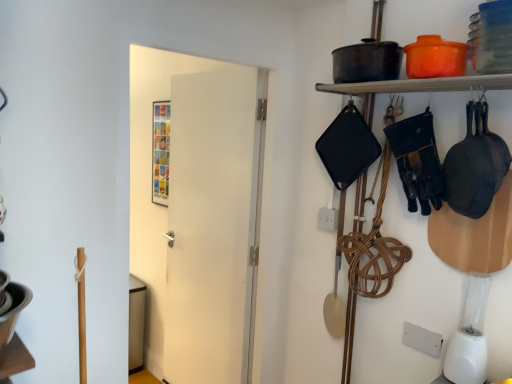
Question: Is matte black pot at upper right at the right side of white matte door at center?

Choices:
 (A) no
 (B) yes

Answer: (B)

Question: Is matte black pot at upper right turned away from white matte door at center?

Choices:
 (A) no
 (B) yes

Answer: (A)

Question: Considering the relative sizes of matte black pot at upper right and white matte door at center in the image provided, is matte black pot at upper right shorter than white matte door at center?

Choices:
 (A) no
 (B) yes

Answer: (B)

Question: Is matte black pot at upper right positioned before white matte door at center?

Choices:
 (A) yes
 (B) no

Answer: (A)

Question: Are matte black pot at upper right and white matte door at center beside each other?

Choices:
 (A) yes
 (B) no

Answer: (B)

Question: Is matte black pot at upper right situated inside white matte door at center or outside?

Choices:
 (A) outside
 (B) inside

Answer: (A)

Question: From the image's perspective, is matte black pot at upper right above or below white matte door at center?

Choices:
 (A) below
 (B) above

Answer: (B)

Question: In terms of width, does matte black pot at upper right look wider or thinner when compared to white matte door at center?

Choices:
 (A) wide
 (B) thin

Answer: (A)

Question: Considering the positions of matte black pot at upper right and white matte door at center in the image, is matte black pot at upper right bigger or smaller than white matte door at center?

Choices:
 (A) big
 (B) small

Answer: (B)

Question: In terms of width, does white matte door at center look wider or thinner when compared to white plastic blender at lower right?

Choices:
 (A) wide
 (B) thin

Answer: (B)

Question: Visually, is white matte door at center positioned to the left or to the right of white plastic blender at lower right?

Choices:
 (A) right
 (B) left

Answer: (B)

Question: From the image's perspective, is white matte door at center located above or below white plastic blender at lower right?

Choices:
 (A) above
 (B) below

Answer: (A)

Question: Considering the positions of white matte door at center and white plastic blender at lower right in the image, is white matte door at center bigger or smaller than white plastic blender at lower right?

Choices:
 (A) big
 (B) small

Answer: (A)

Question: Is white plastic blender at lower right inside the boundaries of matte black pot at upper right, or outside?

Choices:
 (A) inside
 (B) outside

Answer: (B)

Question: From a real-world perspective, is white plastic blender at lower right above or below matte black pot at upper right?

Choices:
 (A) below
 (B) above

Answer: (A)